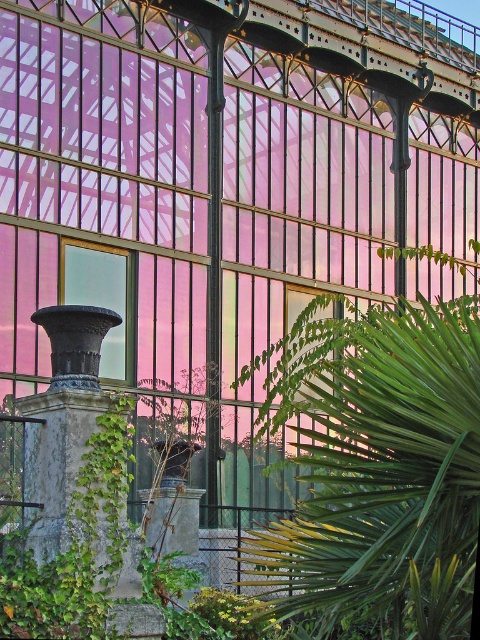
Question: Which point is closer to the camera taking this photo?

Choices:
 (A) (313, 296)
 (B) (68, 452)

Answer: (B)

Question: Among these points, which one is nearest to the camera?

Choices:
 (A) (43, 451)
 (B) (126, 353)
 (C) (349, 401)

Answer: (C)

Question: Is green leafy palm at center to the right of matte black vase at left from the viewer's perspective?

Choices:
 (A) yes
 (B) no

Answer: (A)

Question: Is matte black vase at left positioned in front of transparent glass window at center?

Choices:
 (A) no
 (B) yes

Answer: (B)

Question: Is dark gray stone column at lower left thinner than transparent glass window at center?

Choices:
 (A) no
 (B) yes

Answer: (A)

Question: Which point is closer to the camera?

Choices:
 (A) (132, 257)
 (B) (412, 524)

Answer: (B)